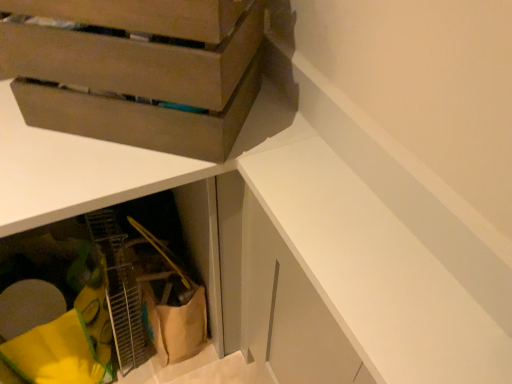
Question: From a real-world perspective, does white matte cabinet at upper right, acting as the first cabinetry starting from the front, stand above matte brown cardboard box at upper left?

Choices:
 (A) no
 (B) yes

Answer: (A)

Question: Does white matte cabinet at upper right, marked as the 1th cabinetry in a right-to-left arrangement, have a larger size compared to matte brown cardboard box at upper left?

Choices:
 (A) yes
 (B) no

Answer: (B)

Question: Could you tell me if white matte cabinet at upper right, marked as the 1th cabinetry in a right-to-left arrangement, is turned towards matte brown cardboard box at upper left?

Choices:
 (A) yes
 (B) no

Answer: (B)

Question: Would you say white matte cabinet at upper right, marked as the 1th cabinetry in a right-to-left arrangement, is outside matte brown cardboard box at upper left?

Choices:
 (A) yes
 (B) no

Answer: (A)

Question: Considering the relative sizes of white matte cabinet at upper right, marked as the 1th cabinetry in a right-to-left arrangement, and matte brown cardboard box at upper left in the image provided, is white matte cabinet at upper right, marked as the 1th cabinetry in a right-to-left arrangement, taller than matte brown cardboard box at upper left?

Choices:
 (A) yes
 (B) no

Answer: (B)

Question: Does point (29, 76) appear closer or farther from the camera than point (118, 256)?

Choices:
 (A) closer
 (B) farther

Answer: (A)

Question: In the image, is matte brown cardboard box at upper left positioned in front of or behind yellow fabric at lower left, which appears as the 2th cabinetry when viewed from the front?

Choices:
 (A) front
 (B) behind

Answer: (A)

Question: From a real-world perspective, is matte brown cardboard box at upper left above or below yellow fabric at lower left, positioned as the 1th cabinetry in left-to-right order?

Choices:
 (A) below
 (B) above

Answer: (B)

Question: Is matte brown cardboard box at upper left bigger or smaller than yellow fabric at lower left, positioned as the 1th cabinetry in left-to-right order?

Choices:
 (A) big
 (B) small

Answer: (B)

Question: From the image's perspective, is yellow fabric at lower left, acting as the 2th cabinetry starting from the right, positioned above or below white matte cabinet at upper right, which is the 2th cabinetry from left to right?

Choices:
 (A) below
 (B) above

Answer: (A)

Question: Is yellow fabric at lower left, the 1th cabinetry positioned from the back, situated inside white matte cabinet at upper right, acting as the first cabinetry starting from the front, or outside?

Choices:
 (A) inside
 (B) outside

Answer: (B)

Question: From a real-world perspective, relative to white matte cabinet at upper right, arranged as the 2th cabinetry when viewed from the back, is yellow fabric at lower left, the 1th cabinetry positioned from the back, vertically above or below?

Choices:
 (A) above
 (B) below

Answer: (B)

Question: Looking at their shapes, would you say yellow fabric at lower left, the 1th cabinetry positioned from the back, is wider or thinner than white matte cabinet at upper right, marked as the 1th cabinetry in a right-to-left arrangement?

Choices:
 (A) wide
 (B) thin

Answer: (A)

Question: Is yellow fabric at lower left, positioned as the 1th cabinetry in left-to-right order, inside or outside of matte brown cardboard box at upper left?

Choices:
 (A) inside
 (B) outside

Answer: (B)

Question: Based on their positions, is yellow fabric at lower left, the 1th cabinetry positioned from the back, located to the left or right of matte brown cardboard box at upper left?

Choices:
 (A) left
 (B) right

Answer: (A)